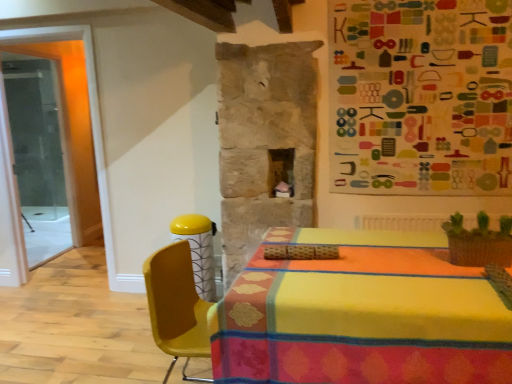
Question: Is multicolored fabric bulletin board at upper right positioned with its back to yellow plastic chair at center?

Choices:
 (A) yes
 (B) no

Answer: (B)

Question: Is the depth of multicolored fabric bulletin board at upper right less than that of yellow plastic chair at center?

Choices:
 (A) yes
 (B) no

Answer: (B)

Question: Is multicolored fabric bulletin board at upper right not inside yellow plastic chair at center?

Choices:
 (A) no
 (B) yes

Answer: (B)

Question: Is multicolored fabric bulletin board at upper right at the left side of yellow plastic chair at center?

Choices:
 (A) yes
 (B) no

Answer: (B)

Question: Is multicolored fabric bulletin board at upper right placed right next to yellow plastic chair at center?

Choices:
 (A) no
 (B) yes

Answer: (A)

Question: Considering the relative sizes of multicolored fabric bulletin board at upper right and yellow plastic chair at center in the image provided, is multicolored fabric bulletin board at upper right wider than yellow plastic chair at center?

Choices:
 (A) no
 (B) yes

Answer: (A)

Question: Is yellow plastic chair at center not inside transparent glass door at left?

Choices:
 (A) no
 (B) yes

Answer: (B)

Question: From the image's perspective, is yellow plastic chair at center beneath transparent glass door at left?

Choices:
 (A) yes
 (B) no

Answer: (A)

Question: Is transparent glass door at left surrounded by yellow plastic chair at center?

Choices:
 (A) no
 (B) yes

Answer: (A)

Question: Considering the relative sizes of yellow plastic chair at center and transparent glass door at left in the image provided, is yellow plastic chair at center thinner than transparent glass door at left?

Choices:
 (A) no
 (B) yes

Answer: (A)

Question: Is yellow plastic chair at center with transparent glass door at left?

Choices:
 (A) yes
 (B) no

Answer: (B)

Question: Does yellow plastic chair at center have a lesser height compared to transparent glass door at left?

Choices:
 (A) yes
 (B) no

Answer: (A)

Question: Would you say transparent glass door at left is a long distance from yellow plastic chair at center?

Choices:
 (A) no
 (B) yes

Answer: (B)